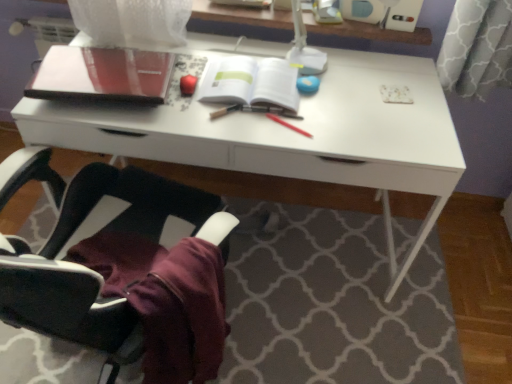
Locate an element on the screen. The height and width of the screenshot is (384, 512). empty space that is in between white paper at center and wooden pencil at center, the second stationery viewed from the right is located at coordinates (241, 117).